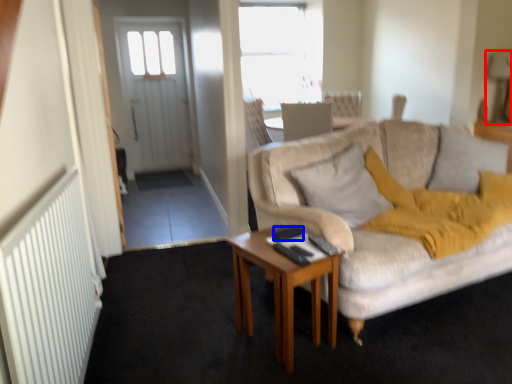
Question: Which point is further to the camera, lamp (highlighted by a red box) or remote control (highlighted by a blue box)?

Choices:
 (A) lamp
 (B) remote control

Answer: (A)